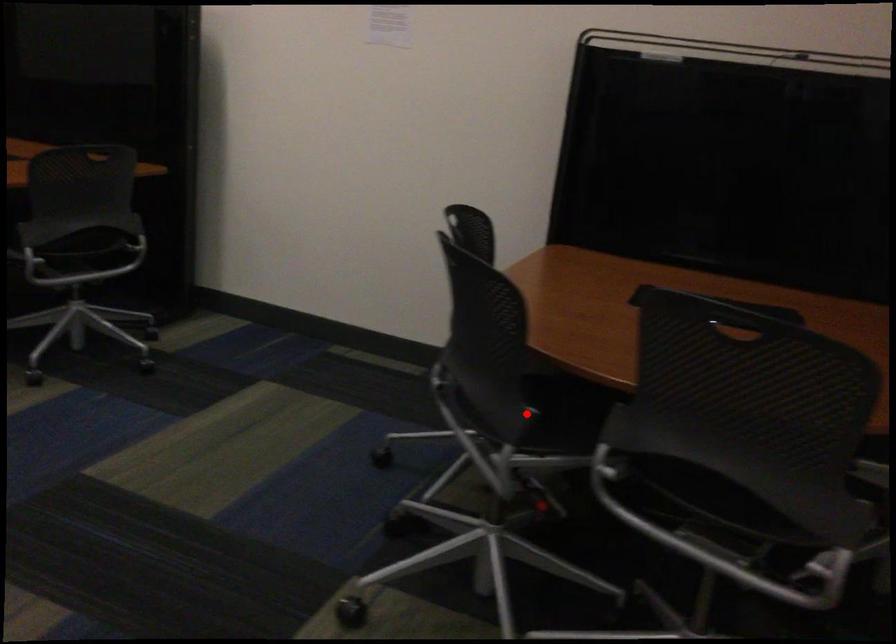
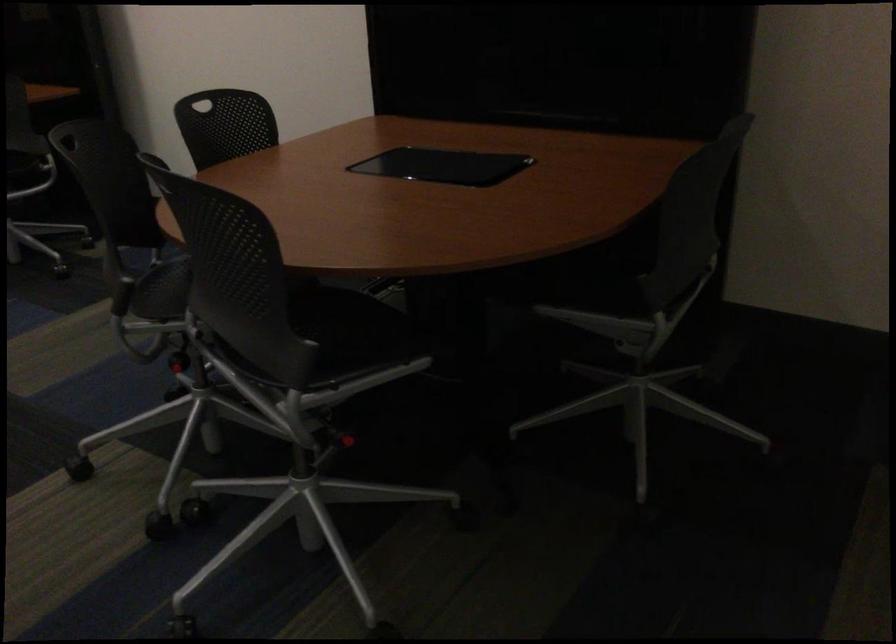
Find the pixel in the second image that matches the highlighted location in the first image.

(126, 287)